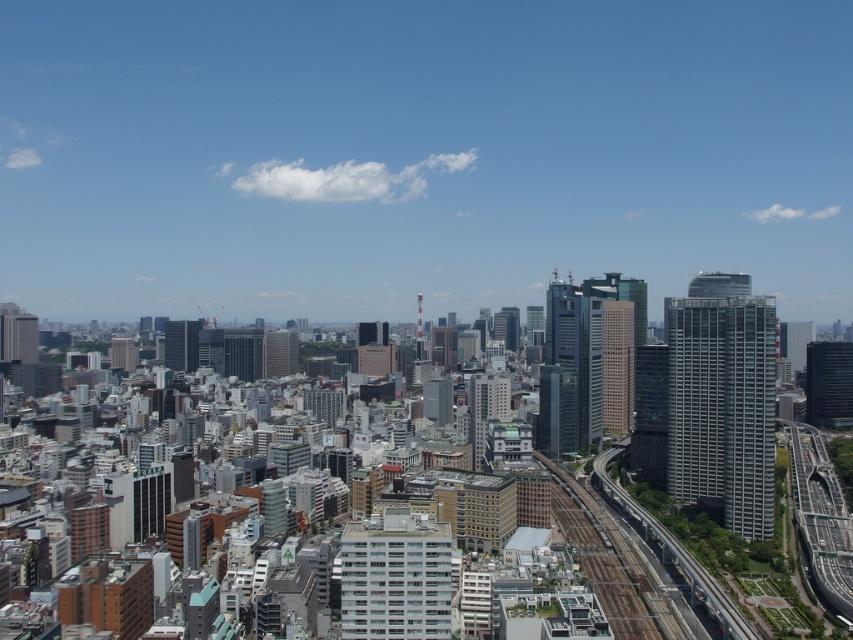
Question: Is metallic gray train track at lower right thinner than matte glass skyscraper at center-left?

Choices:
 (A) no
 (B) yes

Answer: (A)

Question: Where is glassy silver skyscraper at right located in relation to metallic train tracks at lower right in the image?

Choices:
 (A) below
 (B) above

Answer: (B)

Question: Does glassy silver skyscraper at right have a larger size compared to metallic gray train track at lower right?

Choices:
 (A) yes
 (B) no

Answer: (A)

Question: Considering the real-world distances, which object is farthest from the glassy silver skyscraper at right?

Choices:
 (A) metallic silver train track at center-right
 (B) glassy gray skyscraper at center

Answer: (B)

Question: Which point appears farthest from the camera in this image?

Choices:
 (A) coord(686,381)
 (B) coord(381,589)
 (C) coord(711,602)
 (D) coord(624,316)

Answer: (D)

Question: Estimate the real-world distances between objects in this image. Which object is farther from the metallic train tracks at lower right?

Choices:
 (A) white glass building at center
 (B) metallic silver train track at center-right
 (C) glassy gray skyscraper at center

Answer: (A)